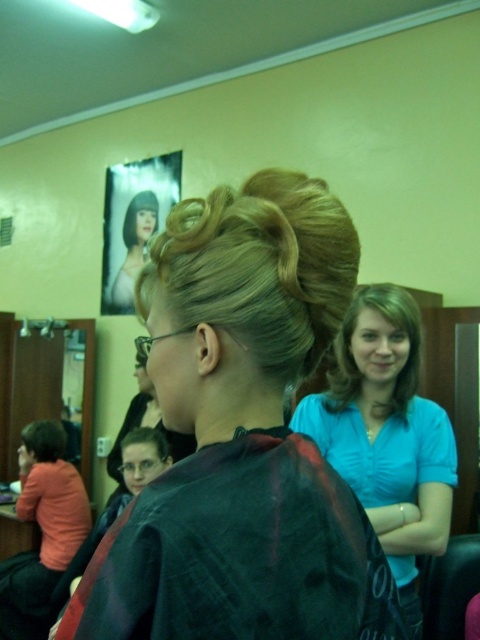
You are standing in the classroom and want to determine which of the two points, point [422,460] or point [131,442], is nearer to you. Based on the scene, which point is closer?

Point [422,460] is closer to the viewer than point [131,442].

You are standing in the classroom and want to move from the point at coordinates point (411, 380) to the point at coordinates point (56, 440). Which direction should you move to get closer to your destination?

To move from point (411, 380) to point (56, 440), you should move downward and to the right because the destination point is located below and to the right of the starting point.

You are organizing a photo shoot and need to ensure that the blue matte shirt at center and the short dark hair at lower left are both visible in the frame. Given their sizes, which object should you prioritize positioning closer to the camera to maintain clarity?

The blue matte shirt at center should be positioned closer to the camera because it has a larger size compared to the short dark hair at lower left, ensuring both remain visible and clear in the frame.